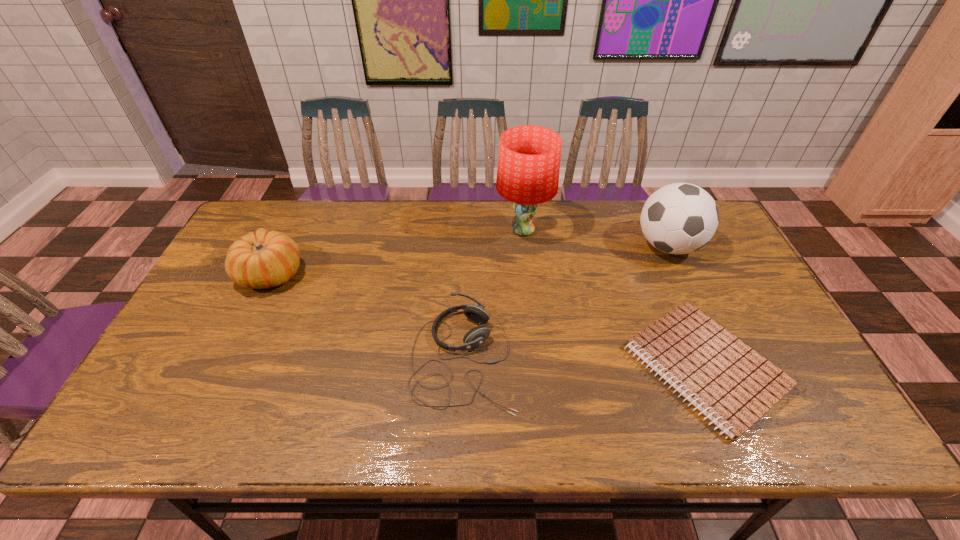
What are the coordinates of `vacant point located between the second tallest object and the tallest object` in the screenshot? It's located at (595, 238).

This screenshot has width=960, height=540. Find the location of `free space between the leftmost object and the tallest object`. free space between the leftmost object and the tallest object is located at coordinates (397, 252).

This screenshot has width=960, height=540. Identify the location of vacant region between the fourth shortest object and the lampshade. (595, 238).

This screenshot has height=540, width=960. In order to click on free space that is in between the notebook and the fourth tallest object in this screenshot , I will do [x=583, y=362].

Identify which object is the third closest to the lampshade. Please provide its 2D coordinates. Your answer should be formatted as a tuple, i.e. [(x, y)], where the tuple contains the x and y coordinates of a point satisfying the conditions above.

[(732, 385)]

Locate which object is the closest to the lampshade. Please provide its 2D coordinates. Your answer should be formatted as a tuple, i.e. [(x, y)], where the tuple contains the x and y coordinates of a point satisfying the conditions above.

[(680, 218)]

Identify the location of vacant space that satisfies the following two spatial constraints: 1. on the front-facing side of the lampshade; 2. on the left side of the soccer ball. (525, 246).

Where is `vacant region that satisfies the following two spatial constraints: 1. on the outer surface of the second shortest object; 2. on the right side of the shortest object`? vacant region that satisfies the following two spatial constraints: 1. on the outer surface of the second shortest object; 2. on the right side of the shortest object is located at coordinates (463, 367).

This screenshot has width=960, height=540. Identify the location of free space that satisfies the following two spatial constraints: 1. on the back side of the fourth shortest object; 2. on the front-facing side of the tallest object. (660, 230).

What are the coordinates of `blank space that satisfies the following two spatial constraints: 1. on the front-facing side of the lampshade; 2. on the left side of the notebook` in the screenshot? It's located at (539, 367).